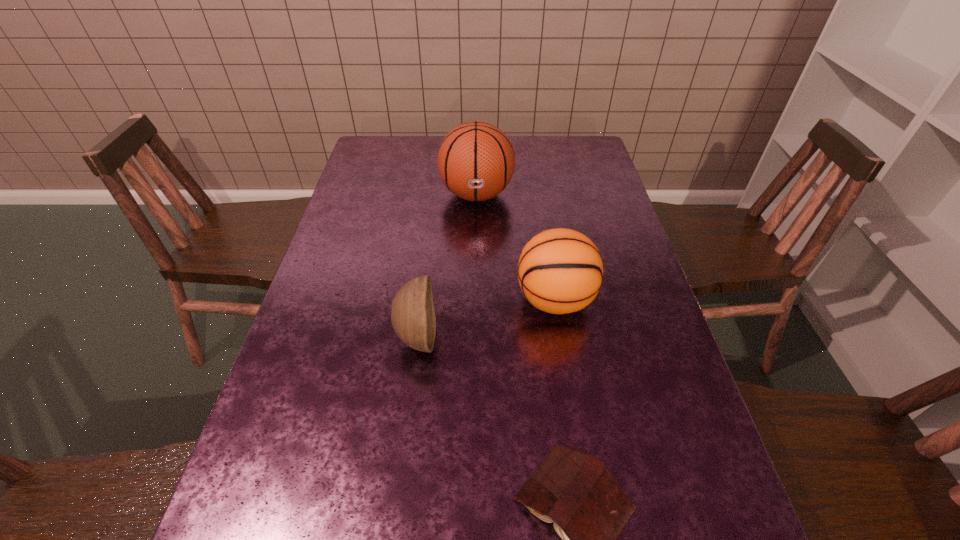
Find the location of a particular element. The width and height of the screenshot is (960, 540). the farthest object is located at coordinates (476, 161).

At what (x,y) coordinates should I click in order to perform the action: click on the taller basketball. Please return your answer as a coordinate pair (x, y). Looking at the image, I should click on (476, 161).

Locate an element on the screen. the shorter basketball is located at coordinates (560, 271).

Identify the location of bowl. The height and width of the screenshot is (540, 960). (413, 318).

You are a GUI agent. You are given a task and a screenshot of the screen. Output one action in this format:
    pyautogui.click(x=<x>, y=<y>)
    Task: Click on the vacant point located 0.130m on the side where the inflation valve is located
    The height and width of the screenshot is (540, 960).
    Given the screenshot: What is the action you would take?
    pyautogui.click(x=476, y=246)

You are a GUI agent. You are given a task and a screenshot of the screen. Output one action in this format:
    pyautogui.click(x=<x>, y=<y>)
    Task: Click on the vacant space located on the front of the nearer basketball
    
    Given the screenshot: What is the action you would take?
    pyautogui.click(x=579, y=450)

At what (x,y) coordinates should I click in order to perform the action: click on free space located on the front of the bowl. Please return your answer as a coordinate pair (x, y). The height and width of the screenshot is (540, 960). Looking at the image, I should click on (407, 415).

Find the location of a particular element. This screenshot has height=540, width=960. object present at the right edge is located at coordinates (560, 271).

Where is `vacant space at the far edge of the desktop`? Image resolution: width=960 pixels, height=540 pixels. vacant space at the far edge of the desktop is located at coordinates (522, 165).

You are a GUI agent. You are given a task and a screenshot of the screen. Output one action in this format:
    pyautogui.click(x=<x>, y=<y>)
    Task: Click on the free space at the left edge
    This screenshot has height=540, width=960.
    Given the screenshot: What is the action you would take?
    pyautogui.click(x=292, y=364)